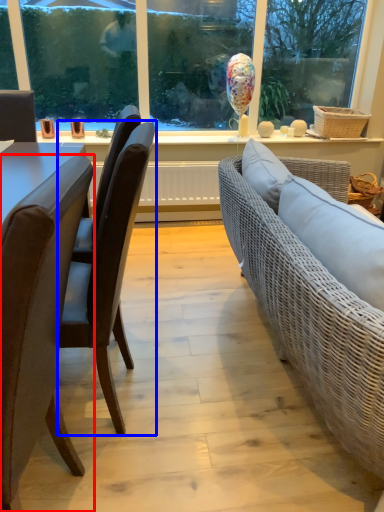
Question: Which of the following is the farthest to the observer, chair (highlighted by a red box) or chair (highlighted by a blue box)?

Choices:
 (A) chair
 (B) chair

Answer: (B)